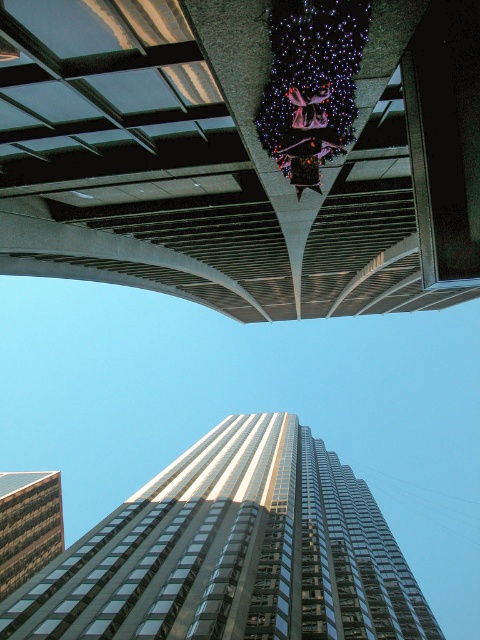
Question: Considering the real-world distances, which object is farthest from the reflective glass skyscraper at center?

Choices:
 (A) metallic gray overpass at upper center
 (B) metallic purple skateboard at center

Answer: (B)

Question: Does metallic gray overpass at upper center have a smaller size compared to metallic purple skateboard at center?

Choices:
 (A) no
 (B) yes

Answer: (A)

Question: Is metallic gray overpass at upper center to the left of reflective glass skyscraper at center from the viewer's perspective?

Choices:
 (A) no
 (B) yes

Answer: (B)

Question: Which of the following is the closest to the observer?

Choices:
 (A) (297, 132)
 (B) (140, 108)
 (C) (2, 554)
 (D) (292, 461)

Answer: (A)

Question: Observing the image, what is the correct spatial positioning of metallic gray overpass at upper center in reference to glassy reflective building at lower left?

Choices:
 (A) below
 (B) above

Answer: (B)

Question: Based on their relative distances, which object is nearer to the metallic purple skateboard at center?

Choices:
 (A) reflective glass skyscraper at center
 (B) glassy reflective building at lower left

Answer: (A)